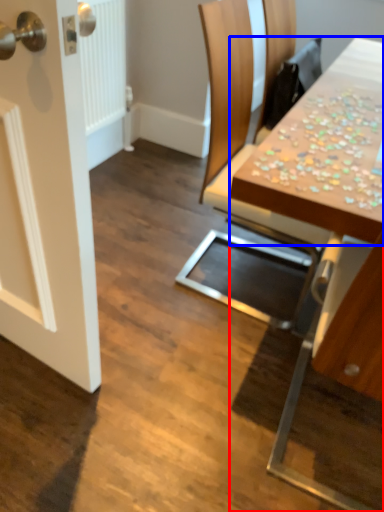
Question: Which object appears closest to the camera in this image, table (highlighted by a red box) or counter top (highlighted by a blue box)?

Choices:
 (A) table
 (B) counter top

Answer: (A)